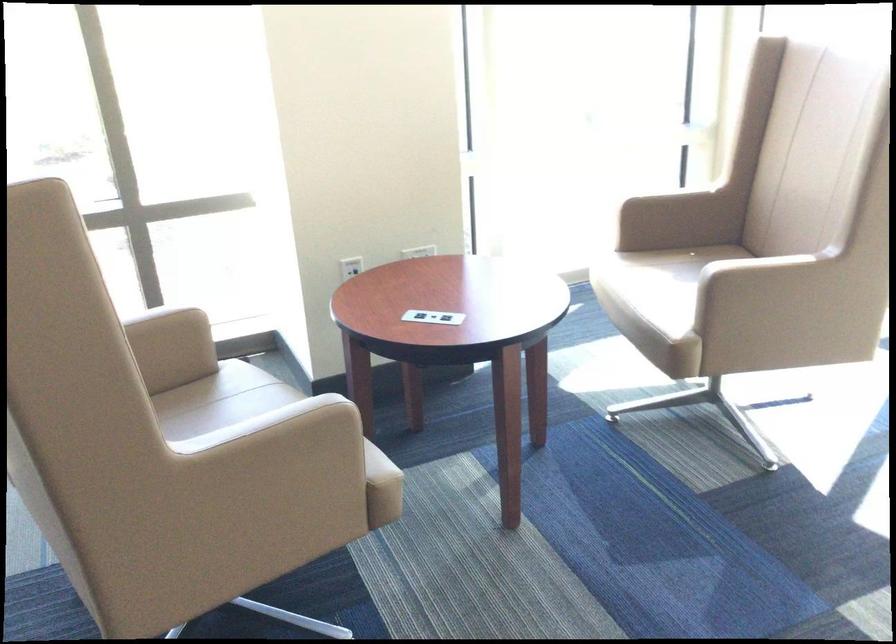
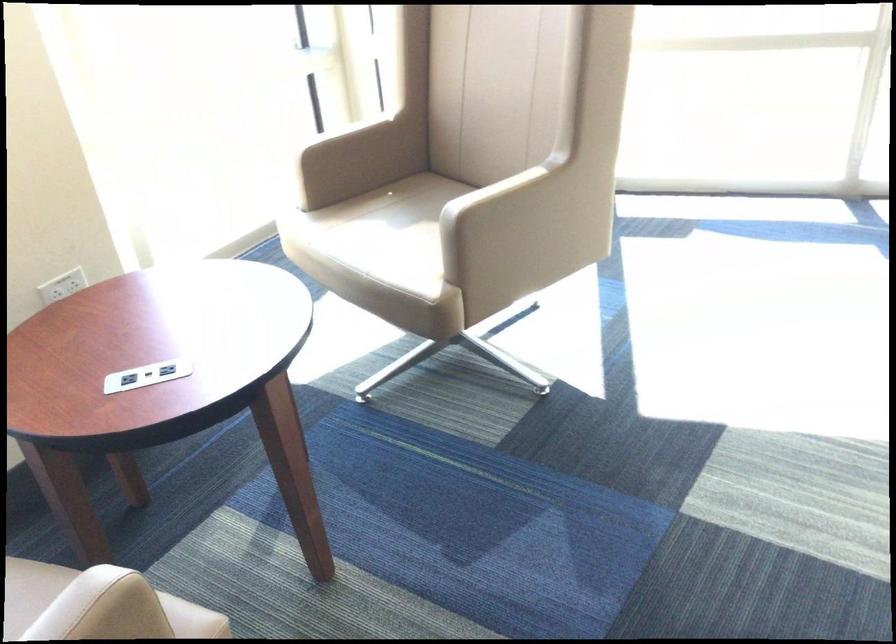
Locate, in the second image, the point that corresponds to pixel 426 316 in the first image.

(147, 375)